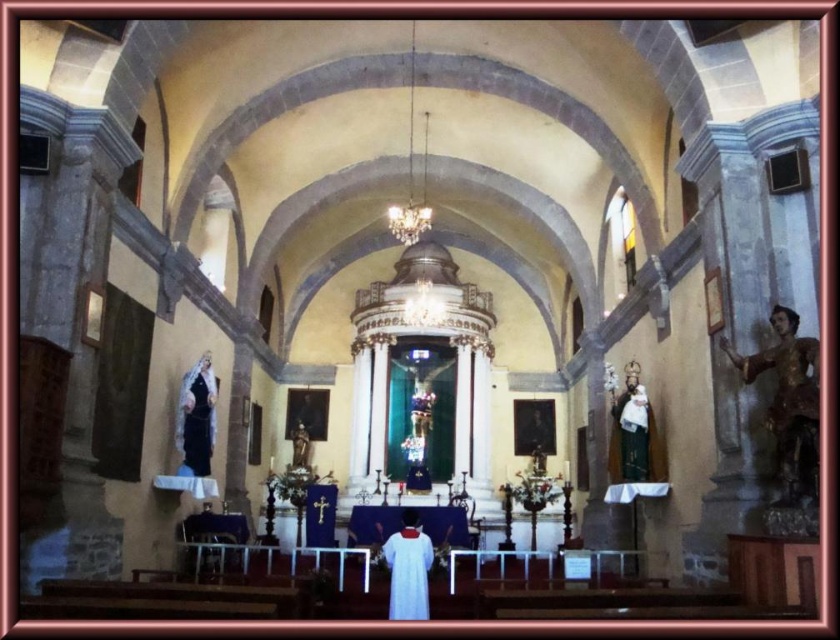
You are an interior designer planning to place a new decorative item in the church. You have a rectangular box that is 1 meter wide. You want to place it near the green velvet statue at right and the white cloth at center. Based on their widths, which object should you place it next to to ensure it fits?

The green velvet statue at right has a width less than the white cloth at center. Since the box is 1 meter wide, it should be placed next to the white cloth at center as it has a wider space available.

From the picture: You are standing in the church and want to place a new flower arrangement between the wooden statue at right and the matte white statue at left. Based on their positions, which statue should you position the flowers closer to?

The wooden statue at right is to the right of the matte white statue at left, so you should place the flowers closer to the matte white statue at left to center them between both statues.

You are a visitor in the church and want to take a photo of both the wooden statue at right and the green velvet statue at right. Can you fit both statues in your camera frame if your camera has a maximum field of view of 20 meters wide?

The wooden statue at right and the green velvet statue at right are 22.00 meters apart, which exceeds the camera field of view of 20 meters. Therefore, both statues cannot be captured in a single frame.